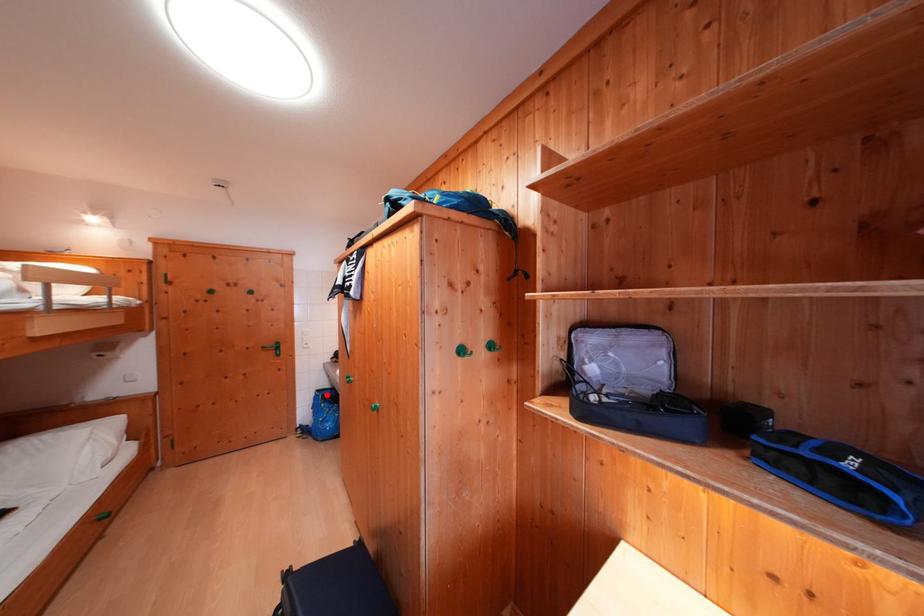
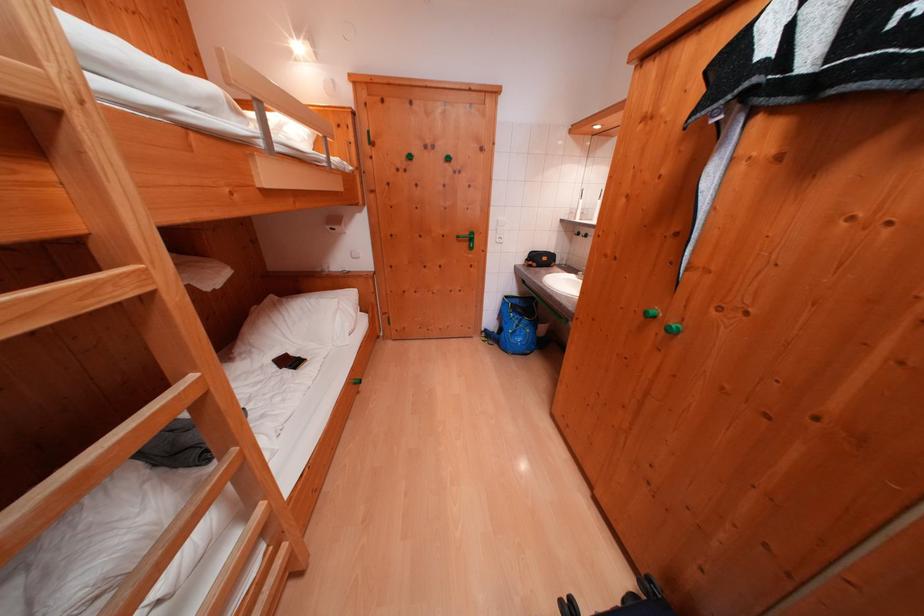
Where in the second image is the point corresponding to the highlighted location from the first image?

(515, 301)